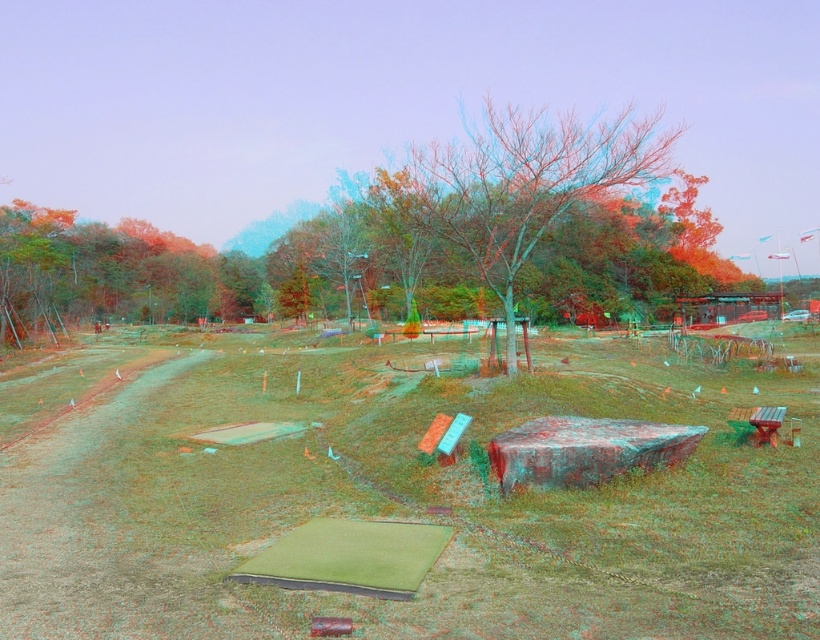
You are standing at the edge of the outdoor recreational area and want to sit down. You see the green grass at center and the wooden bench at lower right. Which option is closer to you where you can sit?

The green grass at center is closer to the viewer than the wooden bench at lower right, so you should choose the green grass at center as it is nearer to your current position.

You are a maintenance worker needing to water the green grass at center from the wooden bench at lower right. If your hose can reach 25 feet, will you need to move the hose reel to water the grass?

The distance between the green grass at center and the wooden bench at lower right is 27.37 feet, which is longer than the hose reach of 25 feet. Therefore, you will need to move the hose reel to water the green grass at center.

You are standing at the point marked as point (3,456) in the outdoor recreational area. You want to retrieve a small item that has rolled away from your current position. Considering the distance between you and the viewer, can you estimate how far you need to walk to reach the viewer?

The distance between point (3,456) and the viewer is 10.65 meters. Therefore, you would need to walk approximately 10.65 meters to reach the viewer.